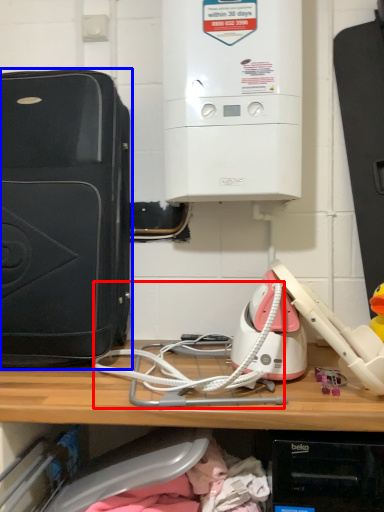
Question: Which point is closer to the camera, wire (highlighted by a red box) or home appliance (highlighted by a blue box)?

Choices:
 (A) wire
 (B) home appliance

Answer: (A)